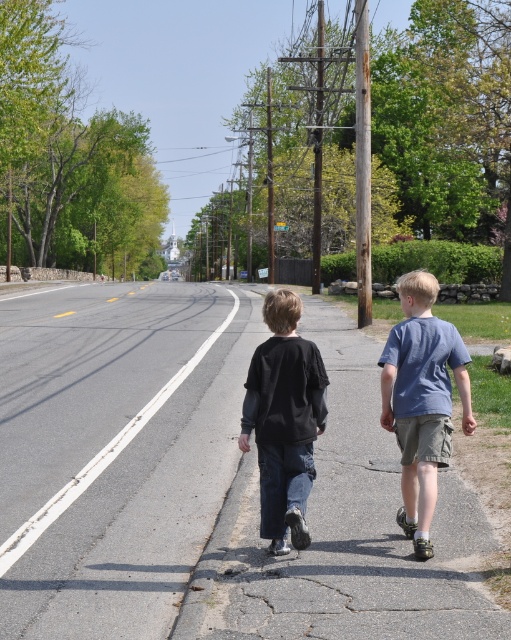
Is gray asphalt road at center behind blue cotton shirt at right?

No, it is in front of blue cotton shirt at right.

Does gray asphalt road at center have a larger size compared to blue cotton shirt at right?

Correct, gray asphalt road at center is larger in size than blue cotton shirt at right.

Locate an element on the screen. gray asphalt road at center is located at coordinates (205, 483).

Identify the location of gray asphalt road at center. (205, 483).

Find the location of a particular element. The height and width of the screenshot is (640, 511). gray asphalt road at center is located at coordinates 205,483.

Does point (236, 380) lie behind point (326, 388)?

Yes, point (236, 380) is farther from viewer.

The height and width of the screenshot is (640, 511). Find the location of `gray asphalt road at center`. gray asphalt road at center is located at coordinates (205, 483).

Is blue cotton shirt at right thinner than black matte pants at center?

Indeed, blue cotton shirt at right has a lesser width compared to black matte pants at center.

Describe the element at coordinates (422, 401) in the screenshot. I see `blue cotton shirt at right` at that location.

Identify the location of blue cotton shirt at right. (x=422, y=401).